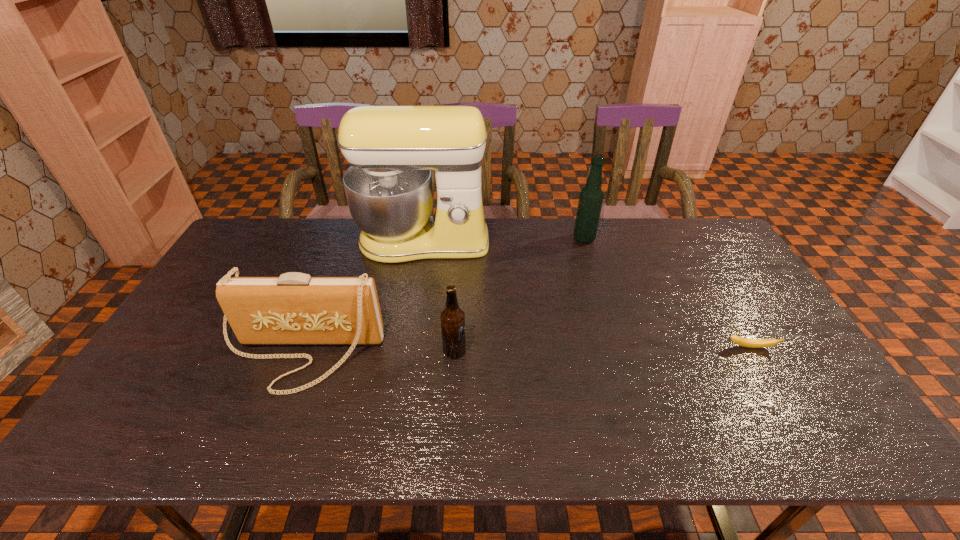
This screenshot has width=960, height=540. What are the coordinates of `object that is the fourth nearest to the beer bottle` in the screenshot? It's located at (745, 342).

Choose which object is the fourth nearest neighbor to the alcohol. Please provide its 2D coordinates. Your answer should be formatted as a tuple, i.e. [(x, y)], where the tuple contains the x and y coordinates of a point satisfying the conditions above.

[(295, 308)]

Image resolution: width=960 pixels, height=540 pixels. Identify the location of free point that satisfies the following two spatial constraints: 1. on the label of the beer bottle; 2. on the decorative side of the handbag. 454,355.

This screenshot has height=540, width=960. I want to click on free location that satisfies the following two spatial constraints: 1. at the stem of the rightmost object; 2. on the label of the beer bottle, so click(753, 351).

The height and width of the screenshot is (540, 960). Find the location of `blank space that satisfies the following two spatial constraints: 1. on the label of the beer bottle; 2. on the decorative side of the handbag`. blank space that satisfies the following two spatial constraints: 1. on the label of the beer bottle; 2. on the decorative side of the handbag is located at coordinates click(x=454, y=355).

Find the location of a particular element. This screenshot has height=540, width=960. blank space that satisfies the following two spatial constraints: 1. at the stem of the rightmost object; 2. on the label of the beer bottle is located at coordinates (753, 351).

Where is `vacant position in the image that satisfies the following two spatial constraints: 1. at the stem of the rightmost object; 2. on the label of the beer bottle`? The height and width of the screenshot is (540, 960). vacant position in the image that satisfies the following two spatial constraints: 1. at the stem of the rightmost object; 2. on the label of the beer bottle is located at coordinates (753, 351).